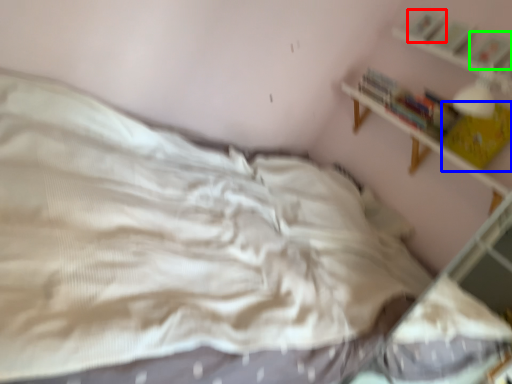
Question: Which object is positioned closest to book (highlighted by a red box)? Select from book (highlighted by a blue box) and book (highlighted by a green box).

Choices:
 (A) book
 (B) book

Answer: (B)